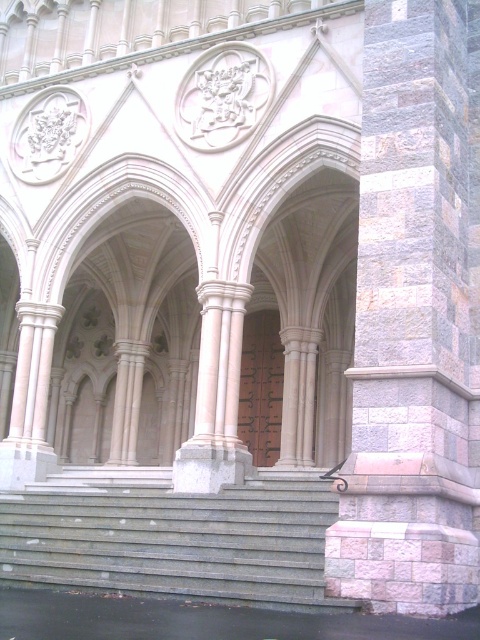
You are standing at the entrance of a historic building and want to know the distance to a specific point marked as point (94, 547). Can you tell me how far it is from where I am standing?

The point (94, 547) is 37.16 meters away from your current position.

You are standing at the entrance of the grand historic building and see two points marked on the facade. Which point, point (387,262) or point (45,541), is closer to you?

Point (387,262) is closer to the viewer than point (45,541).